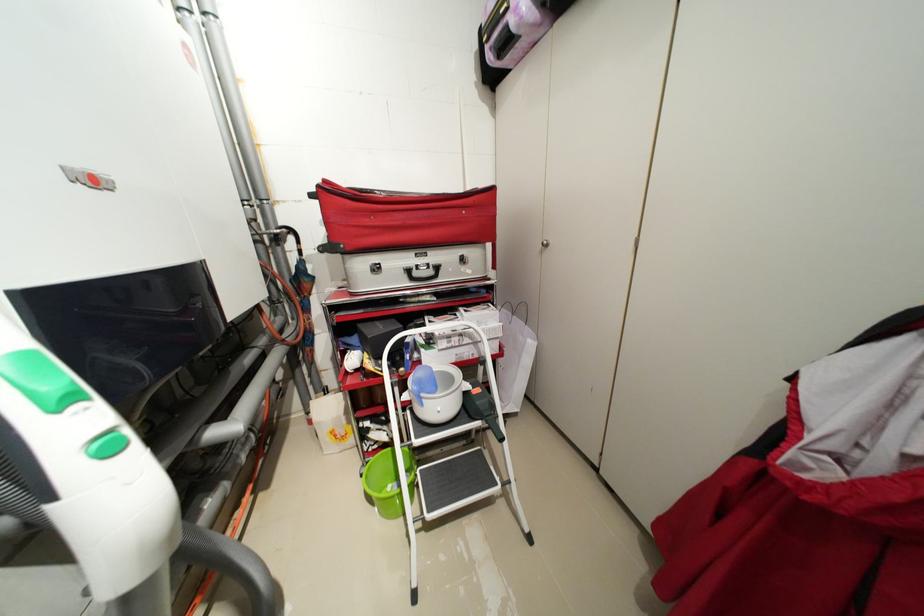
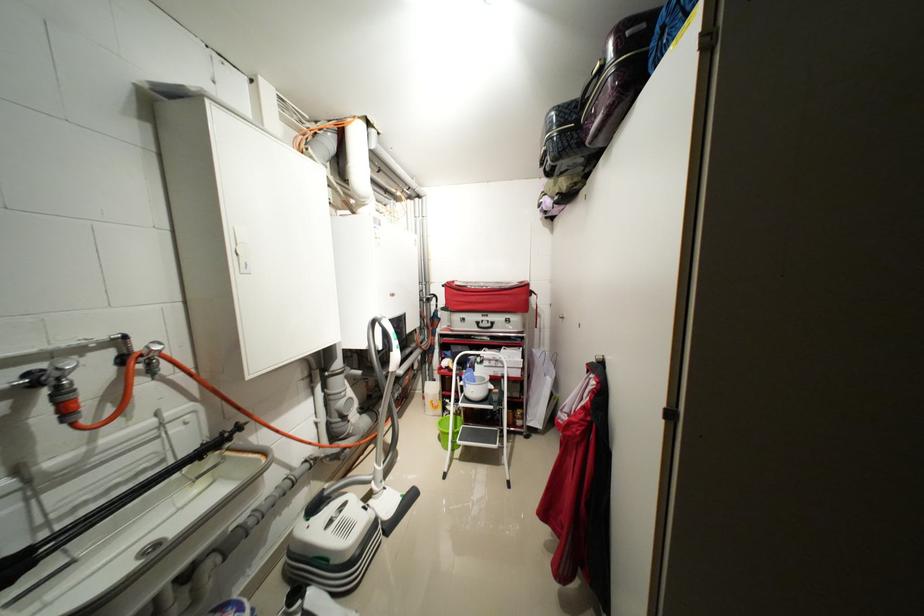
In the second image, find the point that corresponds to (x=456, y=338) in the first image.

(496, 361)